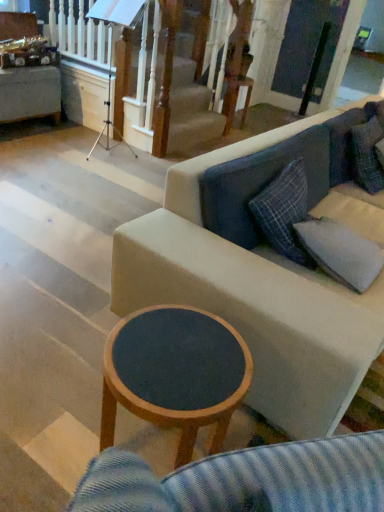
Locate an element on the screen. This screenshot has height=512, width=384. empty space that is ontop of wooden round table at center (from a real-world perspective) is located at coordinates (175, 352).